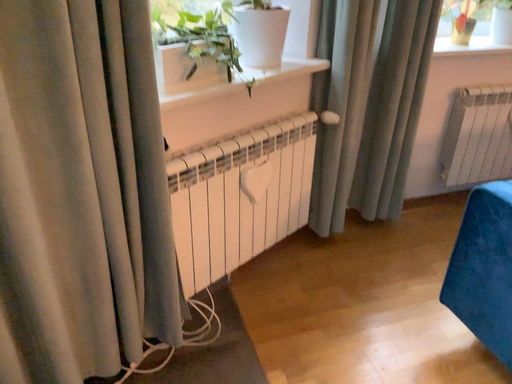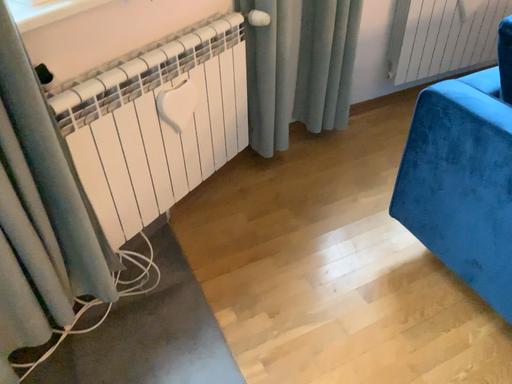
Question: How did the camera likely rotate when shooting the video?

Choices:
 (A) rotated downward
 (B) rotated upward

Answer: (A)